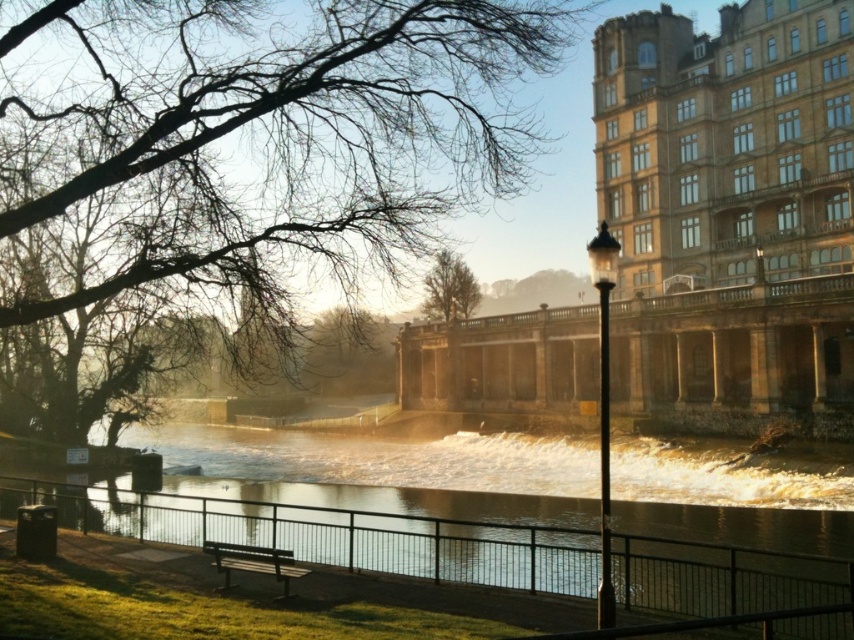
Question: Can you confirm if green leafy tree at center is positioned above wooden bench at lower center?

Choices:
 (A) no
 (B) yes

Answer: (B)

Question: Which point is farther to the camera?

Choices:
 (A) (360, 168)
 (B) (250, 548)
 (C) (287, 544)

Answer: (A)

Question: Is shiny metallic water at center bigger than wooden bench at lower center?

Choices:
 (A) no
 (B) yes

Answer: (B)

Question: Among these objects, which one is nearest to the camera?

Choices:
 (A) wooden bench at lower center
 (B) bare branches at upper left

Answer: (A)

Question: Which point appears closest to the camera in this image?

Choices:
 (A) (458, 285)
 (B) (477, 576)

Answer: (B)

Question: Observing the image, what is the correct spatial positioning of green leafy tree at center in reference to wooden bench at lower center?

Choices:
 (A) below
 (B) above

Answer: (B)